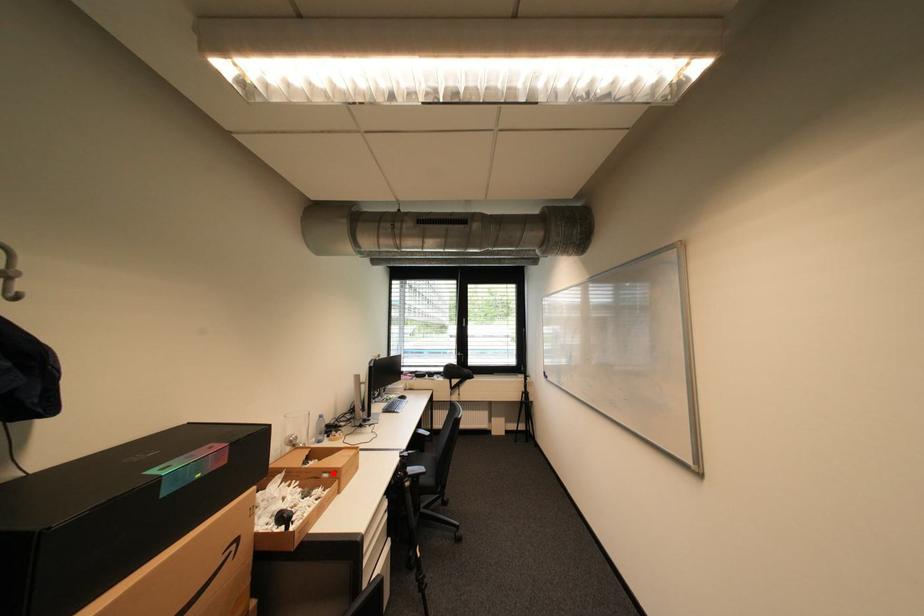
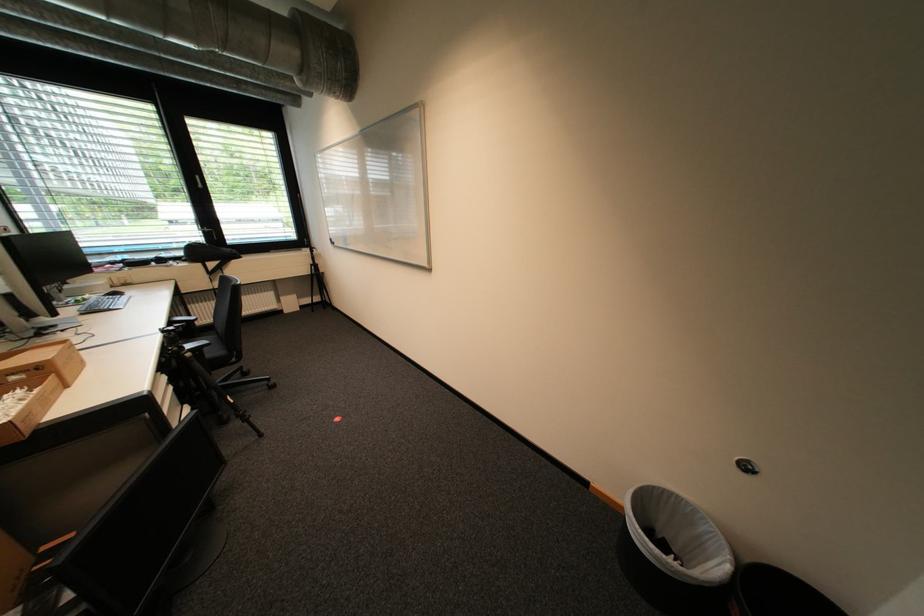
Question: I am providing you with two images of the same scene from different viewpoints. Image1 has a red point marked. In image2, the corresponding 3D location appears at what relative position? Reply with the corresponding letter.

Choices:
 (A) Closer
 (B) Farther

Answer: (B)